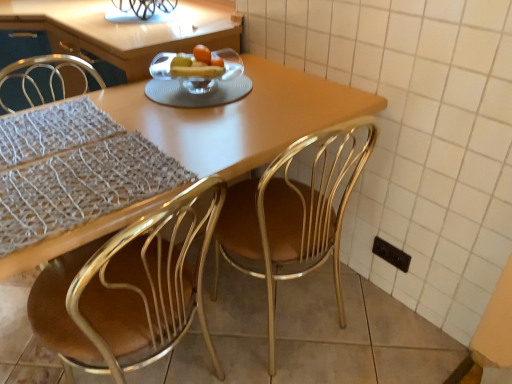
What is the approximate width of metallic gold chair at center, the 1th chair in the right-to-left sequence?

metallic gold chair at center, the 1th chair in the right-to-left sequence, is 17.64 inches in width.

The width and height of the screenshot is (512, 384). What do you see at coordinates (240, 118) in the screenshot?
I see `matte wooden table at center` at bounding box center [240, 118].

What do you see at coordinates (198, 72) in the screenshot? The width and height of the screenshot is (512, 384). I see `clear glass bowl at center` at bounding box center [198, 72].

What is the approximate width of clear glass bowl at center?

The width of clear glass bowl at center is 8.59 inches.

I want to click on black plastic electric outlet at lower right, so click(x=391, y=254).

What do you see at coordinates (391, 254) in the screenshot? I see `black plastic electric outlet at lower right` at bounding box center [391, 254].

Locate an element on the screen. gold metallic chair at center, which is the first chair from left to right is located at coordinates [128, 291].

Could you measure the distance between matte wooden table at center and gold metallic chair at center, positioned as the 2th chair in right-to-left order?

matte wooden table at center is 30.50 centimeters from gold metallic chair at center, positioned as the 2th chair in right-to-left order.

Are matte wooden table at center and gold metallic chair at center, positioned as the 2th chair in right-to-left order, beside each other?

No, matte wooden table at center is not making contact with gold metallic chair at center, positioned as the 2th chair in right-to-left order.

From the picture: Is gold metallic chair at center, which is the first chair from left to right, inside matte wooden table at center?

Yes, gold metallic chair at center, which is the first chair from left to right, is inside matte wooden table at center.

Is matte wooden table at center looking in the opposite direction of gold metallic chair at center, positioned as the 2th chair in right-to-left order?

That's right, matte wooden table at center is facing away from gold metallic chair at center, positioned as the 2th chair in right-to-left order.

Considering the sizes of gold metallic chair at center, positioned as the 2th chair in right-to-left order, and matte wooden table at center in the image, is gold metallic chair at center, positioned as the 2th chair in right-to-left order, wider or thinner than matte wooden table at center?

Considering their sizes, gold metallic chair at center, positioned as the 2th chair in right-to-left order, looks slimmer than matte wooden table at center.

Between gold metallic chair at center, positioned as the 2th chair in right-to-left order, and matte wooden table at center, which one appears on the right side from the viewer's perspective?

From the viewer's perspective, matte wooden table at center appears more on the right side.

Does gold metallic chair at center, positioned as the 2th chair in right-to-left order, have a larger size compared to matte wooden table at center?

No, gold metallic chair at center, positioned as the 2th chair in right-to-left order, is not bigger than matte wooden table at center.

Considering the sizes of objects metallic gold chair at center, the 1th chair in the right-to-left sequence, and gold metallic chair at center, positioned as the 2th chair in right-to-left order, in the image provided, who is thinner, metallic gold chair at center, the 1th chair in the right-to-left sequence, or gold metallic chair at center, positioned as the 2th chair in right-to-left order,?

metallic gold chair at center, the 1th chair in the right-to-left sequence, is thinner.

Which is in front, point (370, 122) or point (174, 255)?

The point (174, 255) is more forward.

Can you confirm if metallic gold chair at center, which is counted as the 2th chair, starting from the left, is smaller than gold metallic chair at center, positioned as the 2th chair in right-to-left order?

Yes.

Could you tell me if metallic gold chair at center, the 1th chair in the right-to-left sequence, is turned towards gold metallic chair at center, positioned as the 2th chair in right-to-left order?

No, metallic gold chair at center, the 1th chair in the right-to-left sequence, is not aimed at gold metallic chair at center, positioned as the 2th chair in right-to-left order.

Which of these two, matte wooden table at center or metallic gold chair at center, which is counted as the 2th chair, starting from the left, stands shorter?

With less height is matte wooden table at center.

Where is `kitchen & dining room table in front of the metallic gold chair at center, the 1th chair in the right-to-left sequence`? kitchen & dining room table in front of the metallic gold chair at center, the 1th chair in the right-to-left sequence is located at coordinates (240, 118).

Choose the correct answer: Is matte wooden table at center inside metallic gold chair at center, the 1th chair in the right-to-left sequence, or outside it?

matte wooden table at center is not inside metallic gold chair at center, the 1th chair in the right-to-left sequence, it's outside.

Which object is wider, matte wooden table at center or metallic gold chair at center, the 1th chair in the right-to-left sequence?

matte wooden table at center is wider.

Is black plastic electric outlet at lower right to the right of matte wooden table at center from the viewer's perspective?

Correct, you'll find black plastic electric outlet at lower right to the right of matte wooden table at center.

How distant is black plastic electric outlet at lower right from matte wooden table at center?

black plastic electric outlet at lower right is 74.47 centimeters from matte wooden table at center.

The image size is (512, 384). Find the location of `kitchen & dining room table lying in front of the black plastic electric outlet at lower right`. kitchen & dining room table lying in front of the black plastic electric outlet at lower right is located at coordinates (240, 118).

Is matte wooden table at center located within black plastic electric outlet at lower right?

No, matte wooden table at center is not inside black plastic electric outlet at lower right.

Is black plastic electric outlet at lower right completely or partially inside clear glass bowl at center?

No, black plastic electric outlet at lower right is not surrounded by clear glass bowl at center.

Which object is closer to the camera taking this photo, clear glass bowl at center or black plastic electric outlet at lower right?

clear glass bowl at center is more forward.

Based on the photo, from a real-world perspective, is clear glass bowl at center beneath black plastic electric outlet at lower right?

Actually, clear glass bowl at center is physically above black plastic electric outlet at lower right in the real world.

Is clear glass bowl at center to the left of black plastic electric outlet at lower right from the viewer's perspective?

Indeed, clear glass bowl at center is positioned on the left side of black plastic electric outlet at lower right.

What's the angular difference between gold metallic chair at center, which is the first chair from left to right, and black plastic electric outlet at lower right's facing directions?

The angle between the facing direction of gold metallic chair at center, which is the first chair from left to right, and the facing direction of black plastic electric outlet at lower right is 85.5 degrees.

From the image's perspective, is gold metallic chair at center, which is the first chair from left to right, located above black plastic electric outlet at lower right?

No, from the image's perspective, gold metallic chair at center, which is the first chair from left to right, is not over black plastic electric outlet at lower right.

Considering the relative positions of gold metallic chair at center, positioned as the 2th chair in right-to-left order, and black plastic electric outlet at lower right in the image provided, is gold metallic chair at center, positioned as the 2th chair in right-to-left order, to the right of black plastic electric outlet at lower right from the viewer's perspective?

Incorrect, gold metallic chair at center, positioned as the 2th chair in right-to-left order, is not on the right side of black plastic electric outlet at lower right.

Considering the points (181, 316) and (394, 254), which point is behind, point (181, 316) or point (394, 254)?

The point (394, 254) is farther from the camera.

You are a GUI agent. You are given a task and a screenshot of the screen. Output one action in this format:
    pyautogui.click(x=<x>, y=<y>)
    Task: Click on the kitchen & dining room table lying above the gold metallic chair at center, positioned as the 2th chair in right-to-left order (from the image's perspective)
    This screenshot has height=384, width=512.
    Given the screenshot: What is the action you would take?
    pyautogui.click(x=240, y=118)

At what (x,y) coordinates should I click in order to perform the action: click on kitchen & dining room table behind the gold metallic chair at center, which is the first chair from left to right. Please return your answer as a coordinate pair (x, y). Looking at the image, I should click on (240, 118).

Based on their spatial positions, is gold metallic chair at center, positioned as the 2th chair in right-to-left order, or matte wooden table at center further from clear glass bowl at center?

gold metallic chair at center, positioned as the 2th chair in right-to-left order, lies further to clear glass bowl at center than the other object.

Based on their spatial positions, is black plastic electric outlet at lower right or metallic gold chair at center, which is counted as the 2th chair, starting from the left, further from clear glass bowl at center?

Based on the image, black plastic electric outlet at lower right appears to be further to clear glass bowl at center.

Estimate the real-world distances between objects in this image. Which object is closer to black plastic electric outlet at lower right, metallic gold chair at center, the 1th chair in the right-to-left sequence, or gold metallic chair at center, positioned as the 2th chair in right-to-left order?

metallic gold chair at center, the 1th chair in the right-to-left sequence.

Considering their positions, is clear glass bowl at center positioned further to metallic gold chair at center, the 1th chair in the right-to-left sequence, than matte wooden table at center?

The object further to metallic gold chair at center, the 1th chair in the right-to-left sequence, is clear glass bowl at center.

From the image, which object appears to be nearer to matte wooden table at center, black plastic electric outlet at lower right or clear glass bowl at center?

clear glass bowl at center.

Based on their spatial positions, is black plastic electric outlet at lower right or gold metallic chair at center, positioned as the 2th chair in right-to-left order, further from metallic gold chair at center, the 1th chair in the right-to-left sequence?

Among the two, black plastic electric outlet at lower right is located further to metallic gold chair at center, the 1th chair in the right-to-left sequence.

Considering their positions, is metallic gold chair at center, the 1th chair in the right-to-left sequence, positioned further to matte wooden table at center than gold metallic chair at center, positioned as the 2th chair in right-to-left order?

The object further to matte wooden table at center is gold metallic chair at center, positioned as the 2th chair in right-to-left order.

Based on their spatial positions, is metallic gold chair at center, which is counted as the 2th chair, starting from the left, or clear glass bowl at center further from gold metallic chair at center, which is the first chair from left to right?

clear glass bowl at center.

Find the location of a particular element. fruit dish between gold metallic chair at center, which is the first chair from left to right, and black plastic electric outlet at lower right from front to back is located at coordinates (198, 72).

Identify the location of chair between clear glass bowl at center and black plastic electric outlet at lower right vertically. The height and width of the screenshot is (384, 512). tap(293, 215).

At what (x,y) coordinates should I click in order to perform the action: click on kitchen & dining room table between clear glass bowl at center and gold metallic chair at center, positioned as the 2th chair in right-to-left order, from top to bottom. Please return your answer as a coordinate pair (x, y). The height and width of the screenshot is (384, 512). Looking at the image, I should click on (240, 118).

You are a GUI agent. You are given a task and a screenshot of the screen. Output one action in this format:
    pyautogui.click(x=<x>, y=<y>)
    Task: Click on the kitchen & dining room table between gold metallic chair at center, positioned as the 2th chair in right-to-left order, and black plastic electric outlet at lower right in the front-back direction
    This screenshot has width=512, height=384.
    Given the screenshot: What is the action you would take?
    pyautogui.click(x=240, y=118)